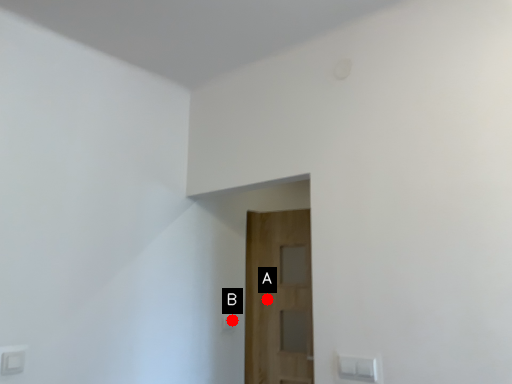
Question: Two points are circled on the image, labeled by A and B beside each circle. Which of the following is the closest to the observer?

Choices:
 (A) A is closer
 (B) B is closer

Answer: (B)